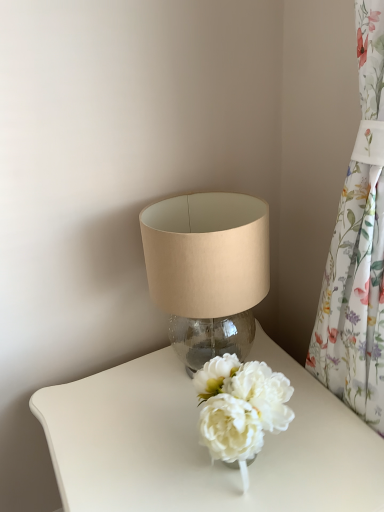
Locate an element on the screen. This screenshot has height=512, width=384. free space above white glossy table at center (from a real-world perspective) is located at coordinates (196, 434).